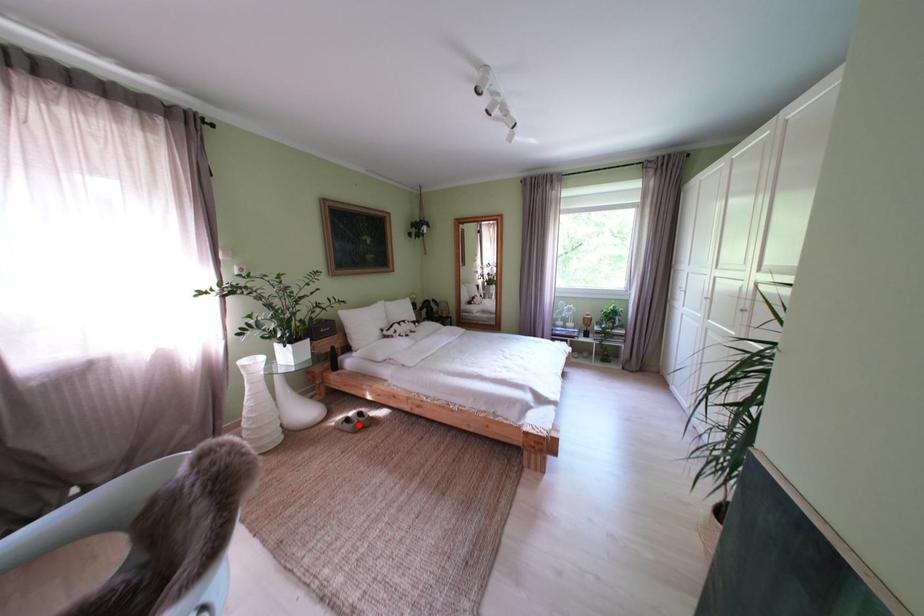
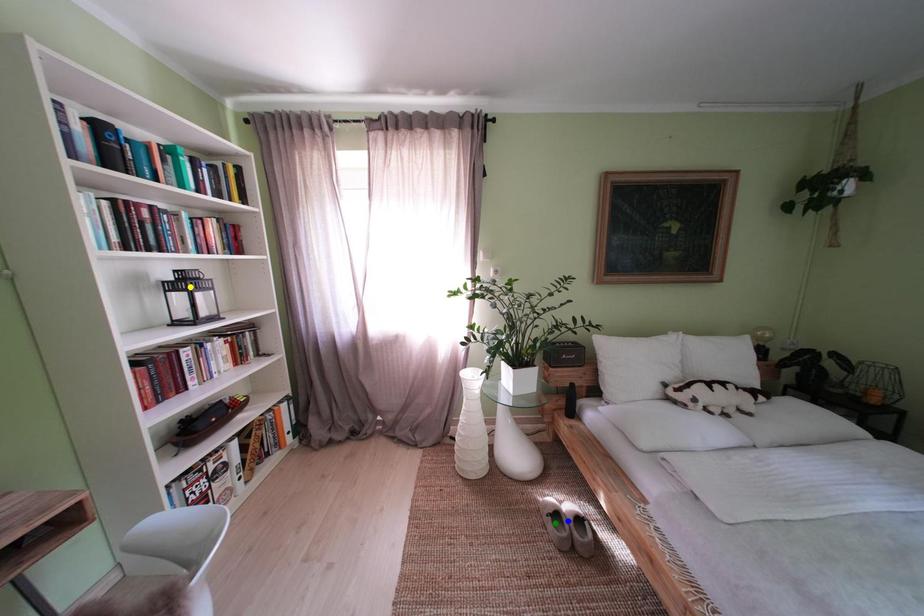
Question: I am providing you with two images of the same scene from different viewpoints. A red point is marked on the first image. You are given multiple points on the second image. Which mark in image 2 goes with the point in image 1?

Choices:
 (A) blue point
 (B) yellow point
 (C) green point

Answer: (A)